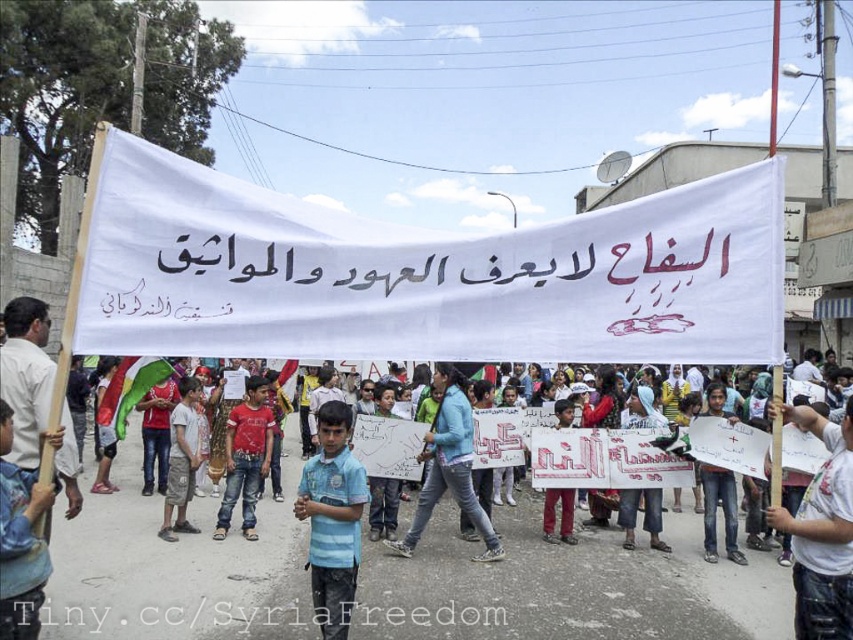
Question: Which of the following is the closest to the observer?

Choices:
 (A) (140, 380)
 (B) (404, 540)
 (C) (347, 536)
 (D) (776, 241)

Answer: (D)

Question: Which point is closer to the camera taking this photo?

Choices:
 (A) (6, 627)
 (B) (416, 516)

Answer: (A)

Question: Is blue jeans at center above green fabric flag at center?

Choices:
 (A) no
 (B) yes

Answer: (A)

Question: Can you confirm if blue striped shirt at center is positioned above blue fabric at center?

Choices:
 (A) no
 (B) yes

Answer: (A)

Question: Does blue striped shirt at center have a lesser width compared to blue jeans at center?

Choices:
 (A) yes
 (B) no

Answer: (A)

Question: Among these points, which one is nearest to the camera?

Choices:
 (A) (409, 552)
 (B) (49, 500)
 (C) (341, 412)
 (D) (727, 307)

Answer: (D)